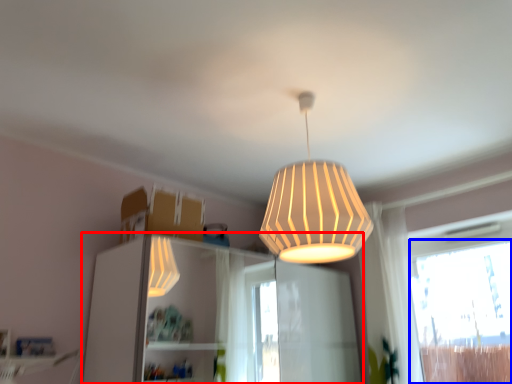
Question: Which of the following is the farthest to the observer, dresser (highlighted by a red box) or window (highlighted by a blue box)?

Choices:
 (A) dresser
 (B) window

Answer: (B)